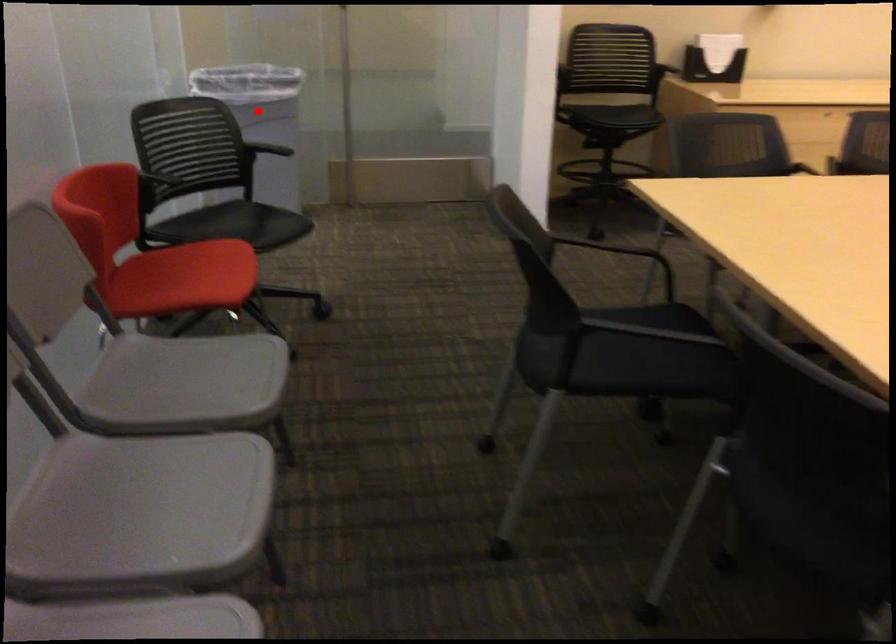
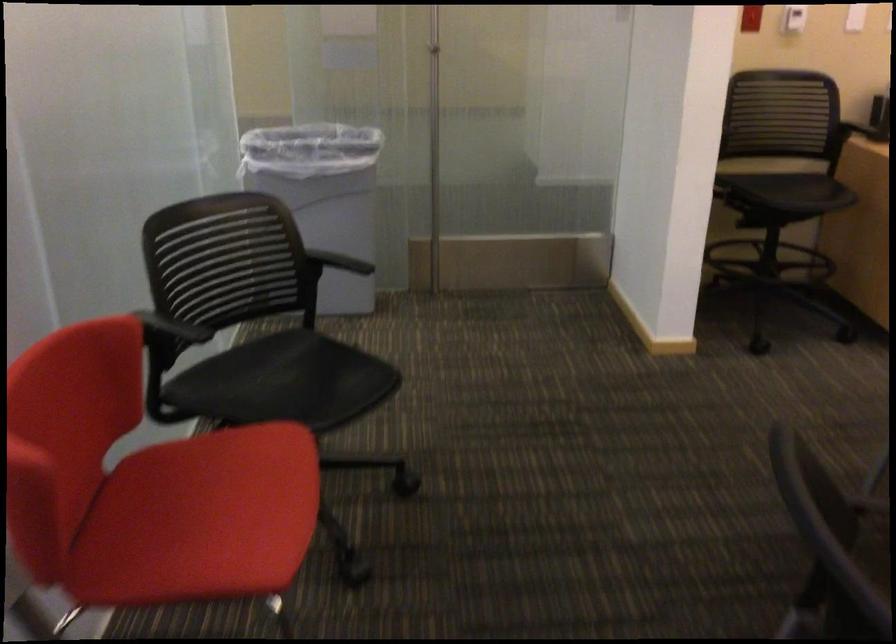
Question: I am providing you with two images of the same scene from different viewpoints. A red point is marked on the first image. Is the red point's position out of view in image 2?

Choices:
 (A) Yes
 (B) No

Answer: (B)